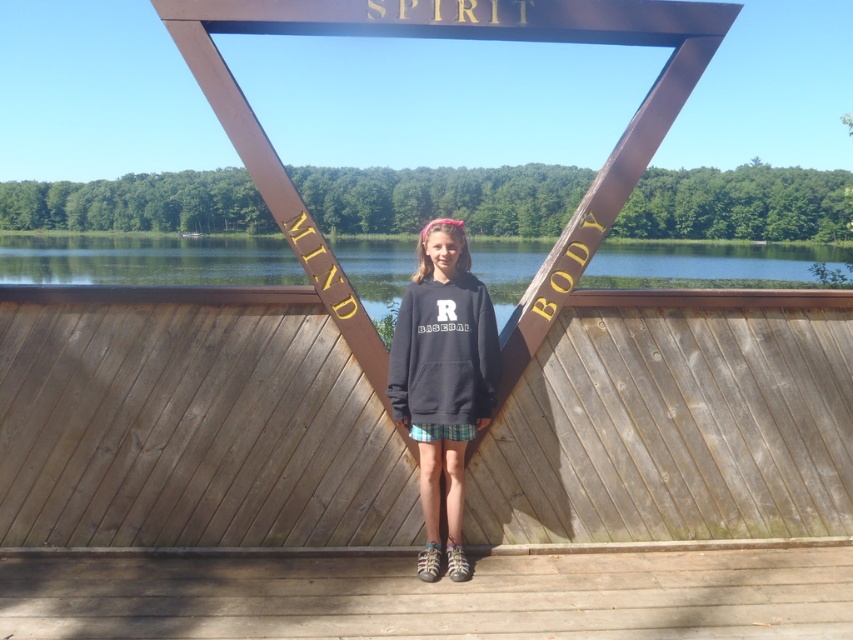
Question: Which point is farther to the camera?

Choices:
 (A) matte black sweatshirt at center
 (B) dark blue hoodie at center
 (C) clear blue water at center

Answer: (C)

Question: Estimate the real-world distances between objects in this image. Which object is farther from the clear blue water at center?

Choices:
 (A) matte black sweatshirt at center
 (B) dark blue hoodie at center

Answer: (B)

Question: Among these objects, which one is nearest to the camera?

Choices:
 (A) clear blue water at center
 (B) matte black sweatshirt at center

Answer: (B)

Question: Does clear blue water at center appear under matte black sweatshirt at center?

Choices:
 (A) no
 (B) yes

Answer: (A)

Question: Is clear blue water at center closer to camera compared to matte black sweatshirt at center?

Choices:
 (A) yes
 (B) no

Answer: (B)

Question: Is clear blue water at center positioned in front of matte black sweatshirt at center?

Choices:
 (A) no
 (B) yes

Answer: (A)